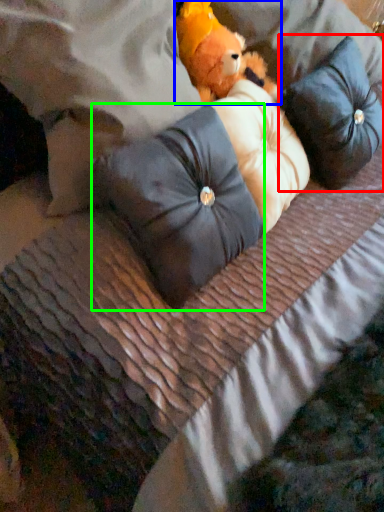
Question: Considering the real-world distances, which object is closest to pillow (highlighted by a red box)? teddy bear (highlighted by a blue box) or pillow (highlighted by a green box).

Choices:
 (A) teddy bear
 (B) pillow

Answer: (A)